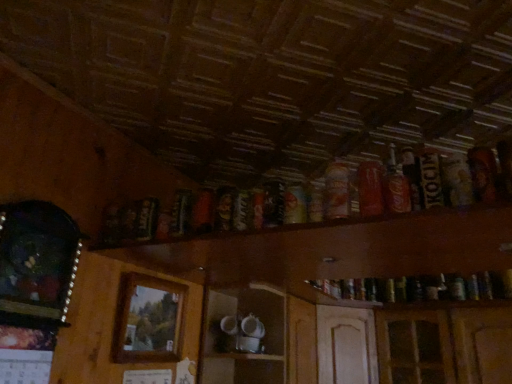
Question: Is shiny metallic can at upper center, the 4th beer from the left, outside of matte red can at upper right, which ranks as the 7th beer in left-to-right order?

Choices:
 (A) no
 (B) yes

Answer: (B)

Question: Considering the relative sizes of shiny metallic can at upper center, the 4th beer from the left, and matte red can at upper right, which ranks as the 7th beer in left-to-right order, in the image provided, is shiny metallic can at upper center, the 4th beer from the left, bigger than matte red can at upper right, which ranks as the 7th beer in left-to-right order,?

Choices:
 (A) yes
 (B) no

Answer: (A)

Question: Is there a large distance between shiny metallic can at upper center, the 5th beer viewed from the right, and matte red can at upper right, which ranks as the 7th beer in left-to-right order?

Choices:
 (A) yes
 (B) no

Answer: (B)

Question: Is matte red can at upper right, which ranks as the 7th beer in left-to-right order, a part of shiny metallic can at upper center, the 5th beer viewed from the right?

Choices:
 (A) no
 (B) yes

Answer: (A)

Question: From a real-world perspective, does shiny metallic can at upper center, the 5th beer viewed from the right, sit lower than matte red can at upper right, which ranks as the 7th beer in left-to-right order?

Choices:
 (A) yes
 (B) no

Answer: (A)

Question: Is shiny metallic can at upper center, the 4th beer from the left, smaller than matte red can at upper right, positioned as the second beer in right-to-left order?

Choices:
 (A) no
 (B) yes

Answer: (A)

Question: Can you see wooden picture frame at left, which ranks as the first picture frame in left-to-right order, touching matte orange can at upper center, the 5th beer positioned from the left?

Choices:
 (A) yes
 (B) no

Answer: (B)

Question: Is matte orange can at upper center, the 5th beer positioned from the left, a part of wooden picture frame at left, the 1th picture frame in the front-to-back sequence?

Choices:
 (A) yes
 (B) no

Answer: (B)

Question: Is wooden picture frame at left, which is the second picture frame in right-to-left order, smaller than matte orange can at upper center, the fourth beer in the right-to-left sequence?

Choices:
 (A) yes
 (B) no

Answer: (B)

Question: Can you confirm if wooden picture frame at left, which ranks as the first picture frame in left-to-right order, is positioned to the left of matte orange can at upper center, the fourth beer in the right-to-left sequence?

Choices:
 (A) yes
 (B) no

Answer: (A)

Question: Is wooden picture frame at left, which is the second picture frame in right-to-left order, positioned in front of matte orange can at upper center, the fourth beer in the right-to-left sequence?

Choices:
 (A) no
 (B) yes

Answer: (B)

Question: Considering the relative positions of wooden picture frame at left, the 1th picture frame in the front-to-back sequence, and matte orange can at upper center, the fourth beer in the right-to-left sequence, in the image provided, is wooden picture frame at left, the 1th picture frame in the front-to-back sequence, to the right of matte orange can at upper center, the fourth beer in the right-to-left sequence, from the viewer's perspective?

Choices:
 (A) no
 (B) yes

Answer: (A)

Question: Does dark brown glass bottle at left, the first beer when ordered from left to right, come behind matte red can at upper right, positioned as the second beer in right-to-left order?

Choices:
 (A) yes
 (B) no

Answer: (A)